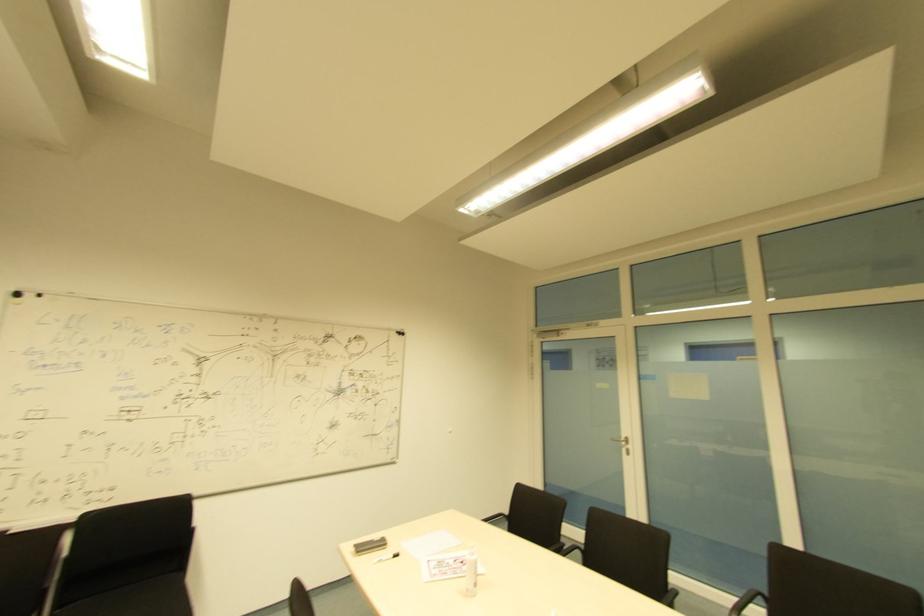
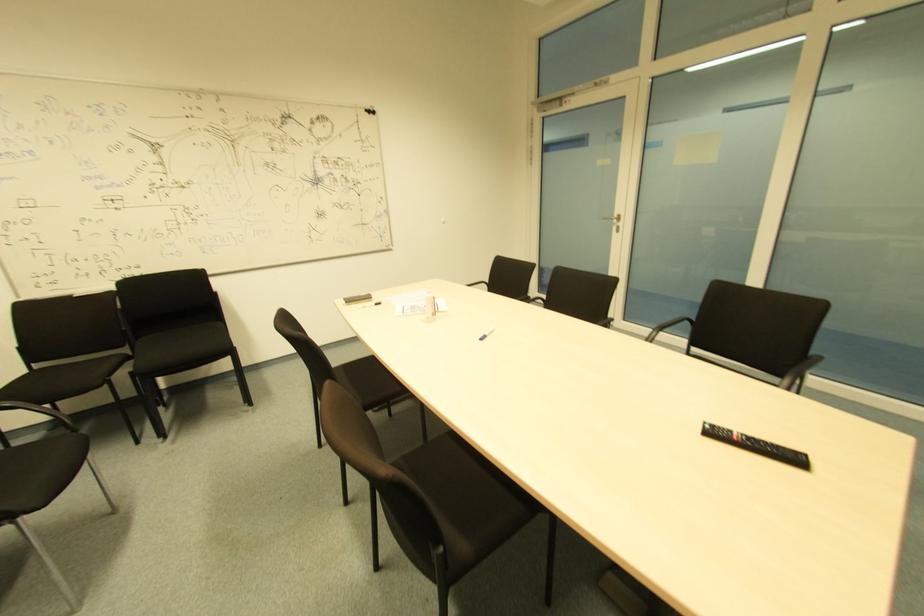
Where in the second image is the point corresponding to point 628,450 from the first image?

(618, 227)